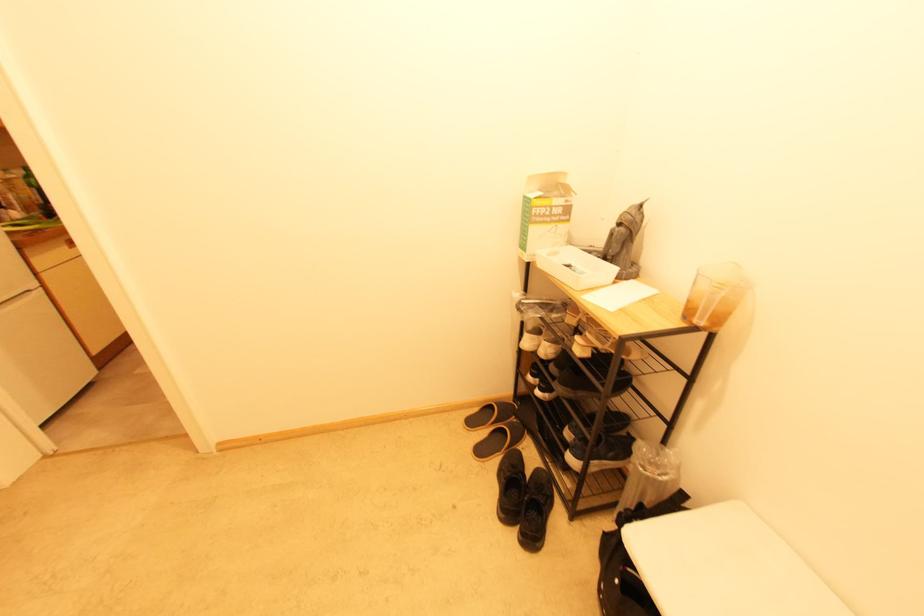
Where would you lift the black shoe? Please return your answer as a coordinate pair (x, y).

(536, 509)